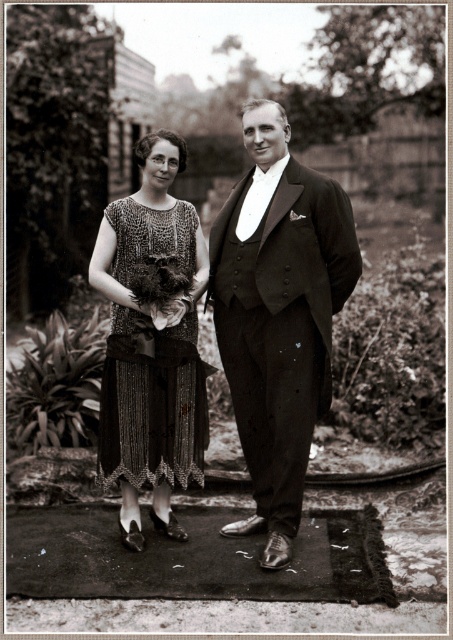
Does smooth black suit at center have a lesser height compared to sequined fabric dress at center?

In fact, smooth black suit at center may be taller than sequined fabric dress at center.

Does point (208, 276) lie in front of point (158, 368)?

No, it is behind (158, 368).

Image resolution: width=453 pixels, height=640 pixels. In order to click on smooth black suit at center in this screenshot , I will do `click(279, 316)`.

This screenshot has height=640, width=453. What are the coordinates of `smooth black suit at center` in the screenshot? It's located at (279, 316).